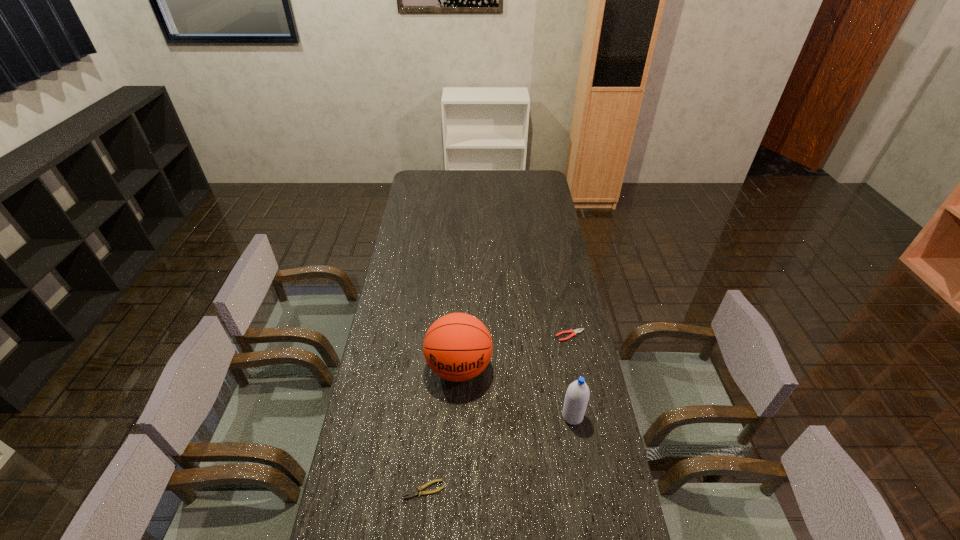
Where is `the third nearest object`? The height and width of the screenshot is (540, 960). the third nearest object is located at coordinates (457, 347).

You are a GUI agent. You are given a task and a screenshot of the screen. Output one action in this format:
    pyautogui.click(x=<x>, y=<y>)
    Task: Click on the water bottle
    
    Given the screenshot: What is the action you would take?
    pyautogui.click(x=577, y=396)

Where is `the farthest object`? The image size is (960, 540). the farthest object is located at coordinates click(x=574, y=332).

The image size is (960, 540). In order to click on the farther pliers in this screenshot , I will do (574, 332).

This screenshot has width=960, height=540. What are the coordinates of `the shortest object` in the screenshot? It's located at (413, 493).

I want to click on the nearest object, so click(413, 493).

You are a GUI agent. You are given a task and a screenshot of the screen. Output one action in this format:
    pyautogui.click(x=<x>, y=<y>)
    Task: Click on the blank space located on the side with logo of the third nearest object
    
    Given the screenshot: What is the action you would take?
    pyautogui.click(x=454, y=492)

At what (x,y) coordinates should I click in order to perform the action: click on vacant area situated on the back of the water bottle. Please return your answer as a coordinate pair (x, y). This screenshot has height=540, width=960. Looking at the image, I should click on (558, 329).

Find the location of a particular element. vacant space located on the front of the right pliers is located at coordinates (582, 396).

You are a GUI agent. You are given a task and a screenshot of the screen. Output one action in this format:
    pyautogui.click(x=<x>, y=<y>)
    Task: Click on the free point located 0.200m on the right of the shortest object
    The image size is (960, 540).
    Given the screenshot: What is the action you would take?
    point(516,489)